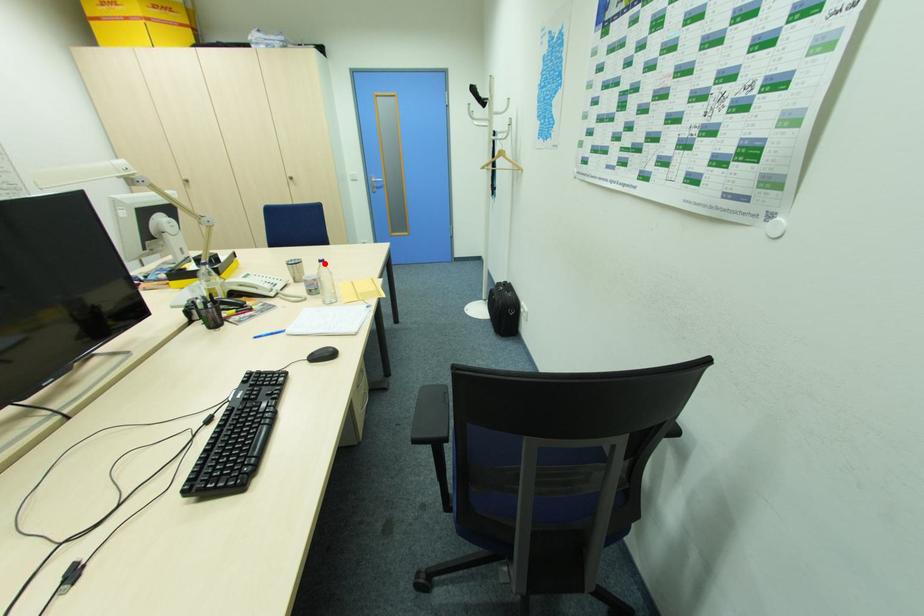
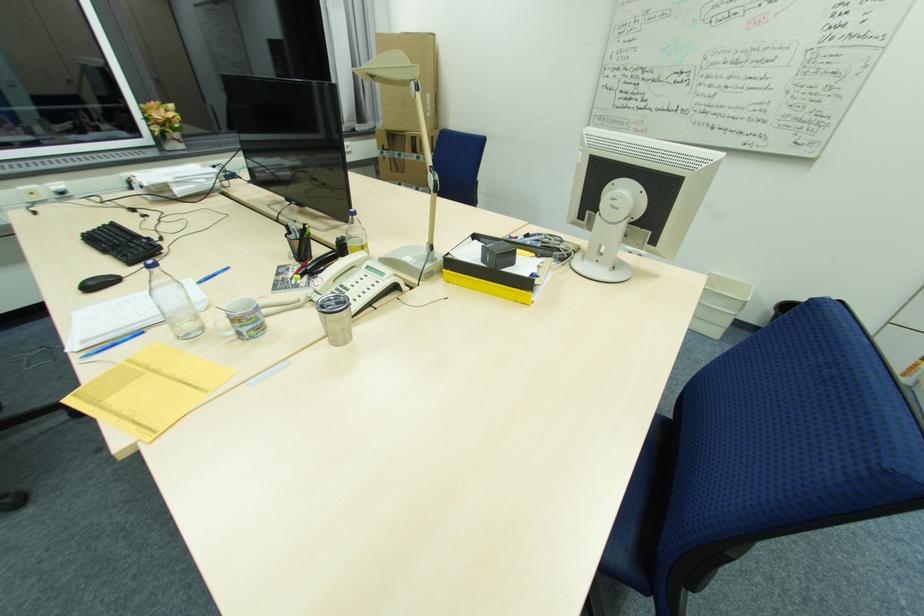
Question: I am providing you with two images of the same scene from different viewpoints. Given a red point in image1, look at the same physical point in image2. Is it:

Choices:
 (A) Closer to the viewpoint
 (B) Farther from the viewpoint

Answer: (B)